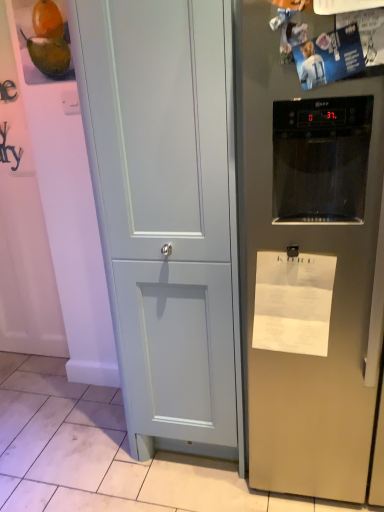
Question: Does matte light blue cabinet at center have a greater height compared to white paper at right?

Choices:
 (A) yes
 (B) no

Answer: (A)

Question: Does matte light blue cabinet at center turn towards white paper at right?

Choices:
 (A) yes
 (B) no

Answer: (B)

Question: Can you confirm if matte light blue cabinet at center is shorter than white paper at right?

Choices:
 (A) yes
 (B) no

Answer: (B)

Question: Does matte light blue cabinet at center appear on the right side of white paper at right?

Choices:
 (A) no
 (B) yes

Answer: (A)

Question: Is matte light blue cabinet at center not close to white paper at right?

Choices:
 (A) yes
 (B) no

Answer: (B)

Question: Does matte light blue cabinet at center lie in front of white paper at right?

Choices:
 (A) no
 (B) yes

Answer: (B)

Question: Is white paper at right wider than satin silver refrigerator at right?

Choices:
 (A) no
 (B) yes

Answer: (A)

Question: From a real-world perspective, is white paper at right beneath satin silver refrigerator at right?

Choices:
 (A) no
 (B) yes

Answer: (B)

Question: Are white paper at right and satin silver refrigerator at right far apart?

Choices:
 (A) no
 (B) yes

Answer: (A)

Question: Is white paper at right facing away from satin silver refrigerator at right?

Choices:
 (A) yes
 (B) no

Answer: (A)

Question: Is white paper at right surrounding satin silver refrigerator at right?

Choices:
 (A) yes
 (B) no

Answer: (B)

Question: Considering the relative sizes of white paper at right and satin silver refrigerator at right in the image provided, is white paper at right taller than satin silver refrigerator at right?

Choices:
 (A) no
 (B) yes

Answer: (A)

Question: Does white paper at right appear on the right side of matte light blue cabinet at center?

Choices:
 (A) no
 (B) yes

Answer: (B)